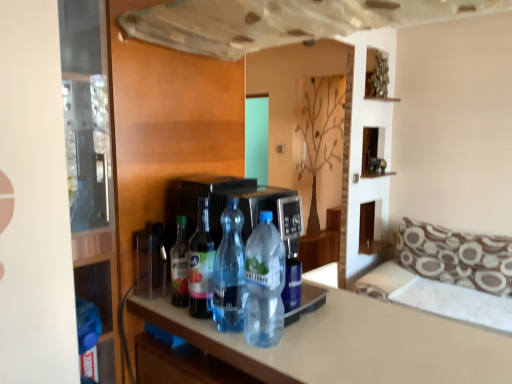
Locate an element on the screen. Image resolution: width=512 pixels, height=384 pixels. free location in front of translucent plastic bottle at center, the first bottle positioned from the left is located at coordinates (186, 324).